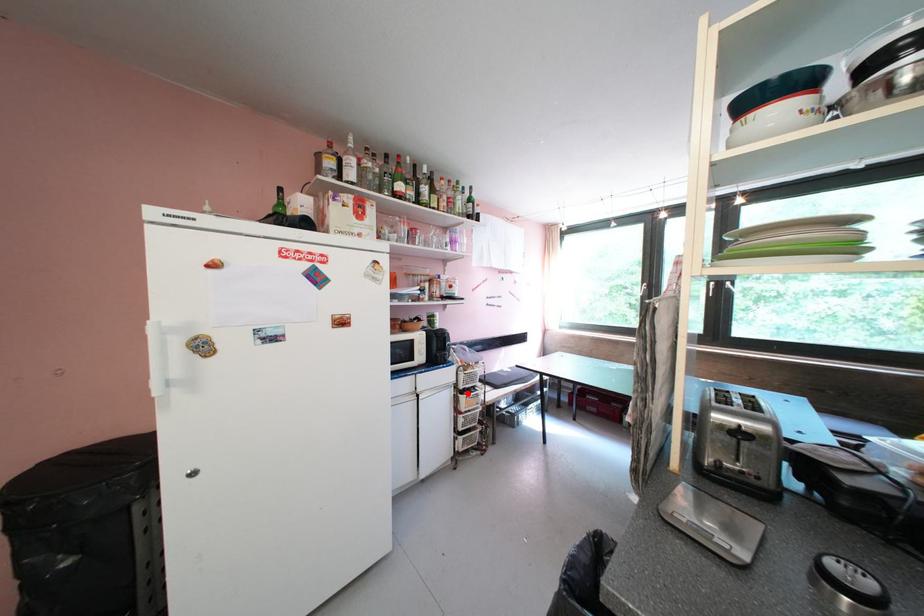
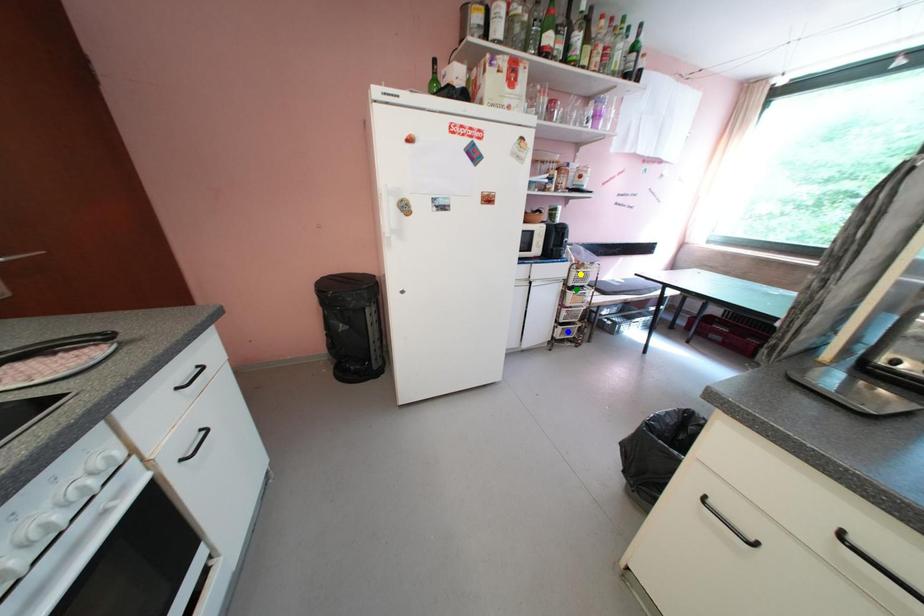
Question: I am providing you with two images of the same scene from different viewpoints. A red point is marked on the first image. You are given multiple points on the second image. Can you choose the point in image 2 that corresponds to the point in image 1?

Choices:
 (A) green point
 (B) blue point
 (C) yellow point

Answer: (A)